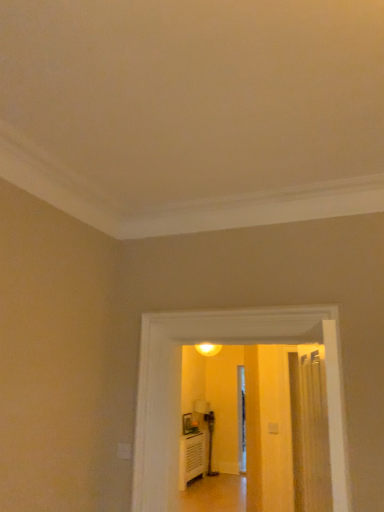
At what (x,y) coordinates should I click in order to perform the action: click on smooth beige carpet at center. Please return your answer as a coordinate pair (x, y). Looking at the image, I should click on (180, 382).

This screenshot has width=384, height=512. Describe the element at coordinates (180, 382) in the screenshot. I see `smooth beige carpet at center` at that location.

What do you see at coordinates (215, 494) in the screenshot?
I see `wooden floor at lower center` at bounding box center [215, 494].

Image resolution: width=384 pixels, height=512 pixels. I want to click on wooden floor at lower center, so click(x=215, y=494).

Locate an element on the screen. smooth beige carpet at center is located at coordinates (180, 382).

Considering the relative positions of wooden floor at lower center and smooth beige carpet at center in the image provided, is wooden floor at lower center to the left or to the right of smooth beige carpet at center?

Clearly, wooden floor at lower center is on the right of smooth beige carpet at center in the image.

Is the position of wooden floor at lower center less distant than that of smooth beige carpet at center?

No, it is behind smooth beige carpet at center.

Between point (217, 511) and point (174, 468), which one is positioned in front?

The point (174, 468) is closer to the camera.

From the image's perspective, who appears lower, wooden floor at lower center or smooth beige carpet at center?

From the image's view, wooden floor at lower center is below.

From a real-world perspective, is wooden floor at lower center positioned under smooth beige carpet at center based on gravity?

Yes, from a real-world perspective, wooden floor at lower center is beneath smooth beige carpet at center.

Can you confirm if wooden floor at lower center is wider than smooth beige carpet at center?

Yes.

Is wooden floor at lower center shorter than smooth beige carpet at center?

Yes, wooden floor at lower center is shorter than smooth beige carpet at center.

Looking at this image, can you confirm if wooden floor at lower center is bigger than smooth beige carpet at center?

Incorrect, wooden floor at lower center is not larger than smooth beige carpet at center.

Does wooden floor at lower center contain smooth beige carpet at center?

No, smooth beige carpet at center is not a part of wooden floor at lower center.

Is wooden floor at lower center next to smooth beige carpet at center and touching it?

No, wooden floor at lower center is not next to smooth beige carpet at center.

Is wooden floor at lower center facing towards smooth beige carpet at center?

No, wooden floor at lower center is not aimed at smooth beige carpet at center.

Can you tell me how much wooden floor at lower center and smooth beige carpet at center differ in facing direction?

0.858 degrees separate the facing orientations of wooden floor at lower center and smooth beige carpet at center.

The image size is (384, 512). I want to click on corridor that appears in front of the wooden floor at lower center, so click(x=180, y=382).

Based on their positions, is smooth beige carpet at center located to the left or right of wooden floor at lower center?

From the image, it's evident that smooth beige carpet at center is to the left of wooden floor at lower center.

Is smooth beige carpet at center further to the viewer compared to wooden floor at lower center?

That is False.

Considering the positions of points (136, 496) and (245, 509), is point (136, 496) farther from camera compared to point (245, 509)?

No, (136, 496) is closer to viewer.

From the image's perspective, is smooth beige carpet at center located beneath wooden floor at lower center?

No.

Looking at this image, from a real-world perspective, is smooth beige carpet at center physically above wooden floor at lower center?

Indeed, from a real-world perspective, smooth beige carpet at center stands above wooden floor at lower center.

Is smooth beige carpet at center wider or thinner than wooden floor at lower center?

In the image, smooth beige carpet at center appears to be more narrow than wooden floor at lower center.

Considering the sizes of smooth beige carpet at center and wooden floor at lower center in the image, is smooth beige carpet at center taller or shorter than wooden floor at lower center?

In the image, smooth beige carpet at center appears to be taller than wooden floor at lower center.

Between smooth beige carpet at center and wooden floor at lower center, which one has larger size?

smooth beige carpet at center.

Is smooth beige carpet at center located outside wooden floor at lower center?

Yes, smooth beige carpet at center is outside of wooden floor at lower center.

Is the surface of smooth beige carpet at center in direct contact with wooden floor at lower center?

No, smooth beige carpet at center is not touching wooden floor at lower center.

Is smooth beige carpet at center facing away from wooden floor at lower center?

Yes.

Identify the location of path below the smooth beige carpet at center (from a real-world perspective). (215, 494).

You are a GUI agent. You are given a task and a screenshot of the screen. Output one action in this format:
    pyautogui.click(x=<x>, y=<y>)
    Task: Click on the corridor that appears above the wooden floor at lower center (from a real-world perspective)
    This screenshot has height=512, width=384.
    Given the screenshot: What is the action you would take?
    pyautogui.click(x=180, y=382)

At what (x,y) coordinates should I click in order to perform the action: click on corridor above the wooden floor at lower center (from the image's perspective). Please return your answer as a coordinate pair (x, y). The width and height of the screenshot is (384, 512). Looking at the image, I should click on 180,382.